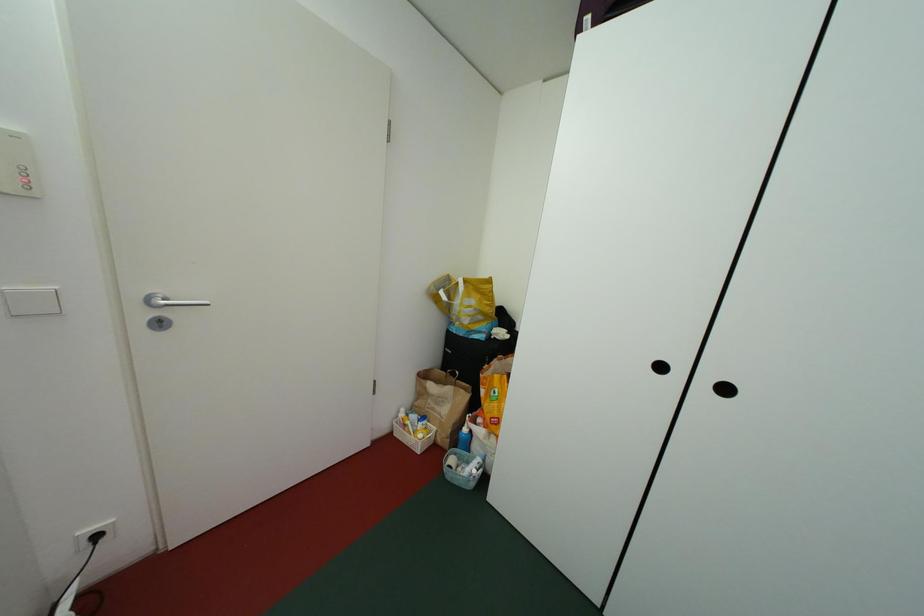
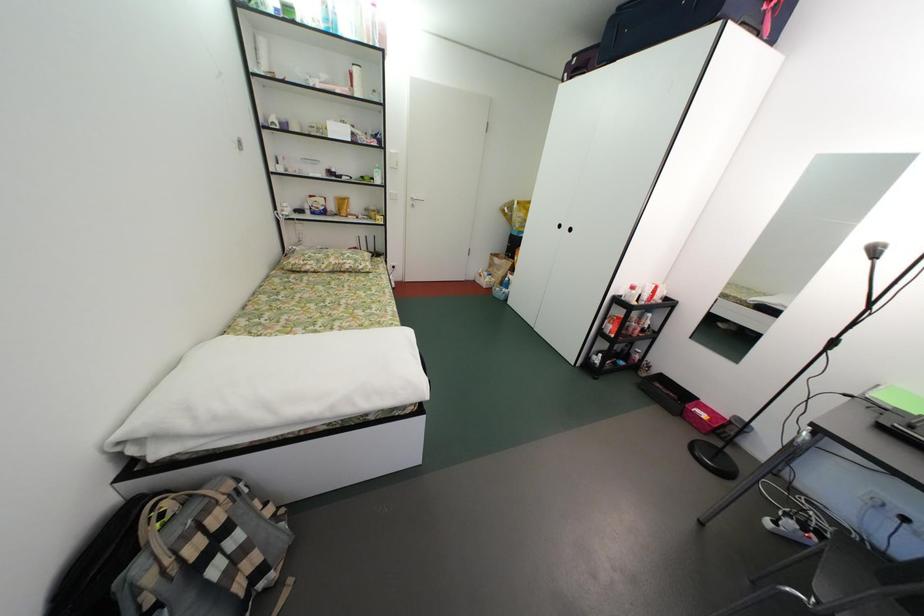
Looking at this image, what movement of the cameraman would produce the second image?

The cameraman moved toward right, backward.